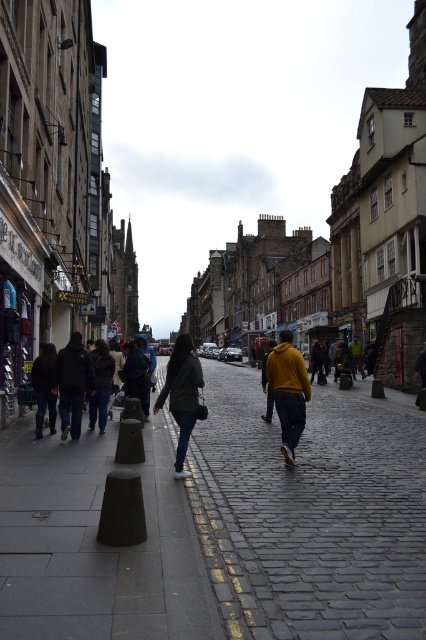
Question: Considering the real-world distances, which object is closest to the dark gray jacket at lower left?

Choices:
 (A) dark gray hoodie at left
 (B) black rubber cone at center
 (C) matte yellow hoodie at center
 (D) dark gray fabric jacket at lower left

Answer: (A)

Question: Which object appears closest to the camera in this image?

Choices:
 (A) dark gray jacket at lower left
 (B) yellow matte jacket at center
 (C) dark gray fabric jacket at lower left
 (D) dark gray hoodie at left

Answer: (C)

Question: Which object is positioned farthest from the dark gray jacket at lower left?

Choices:
 (A) yellow matte jacket at center
 (B) green matte jacket at center

Answer: (A)

Question: Is matte yellow hoodie at center bigger than dark gray jacket at lower left?

Choices:
 (A) yes
 (B) no

Answer: (A)

Question: Is gray cobblestone pavement at center smaller than black rubber cone at center?

Choices:
 (A) no
 (B) yes

Answer: (A)

Question: Can you confirm if gray cobblestone pavement at center is smaller than dark gray jacket at center?

Choices:
 (A) yes
 (B) no

Answer: (B)